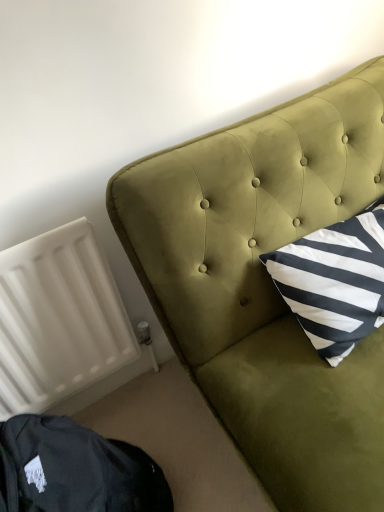
Question: Is velvet green headboard at upper right bigger or smaller than white matte radiator at lower left?

Choices:
 (A) small
 (B) big

Answer: (B)

Question: Is velvet green headboard at upper right in front of or behind white matte radiator at lower left in the image?

Choices:
 (A) front
 (B) behind

Answer: (A)

Question: Which is farther from the white matte radiator at lower left?

Choices:
 (A) dark green velvet bean bag chair at lower left
 (B) velvet green headboard at upper right

Answer: (B)

Question: Which is nearer to the dark green velvet bean bag chair at lower left?

Choices:
 (A) white matte radiator at lower left
 (B) velvet green headboard at upper right

Answer: (A)